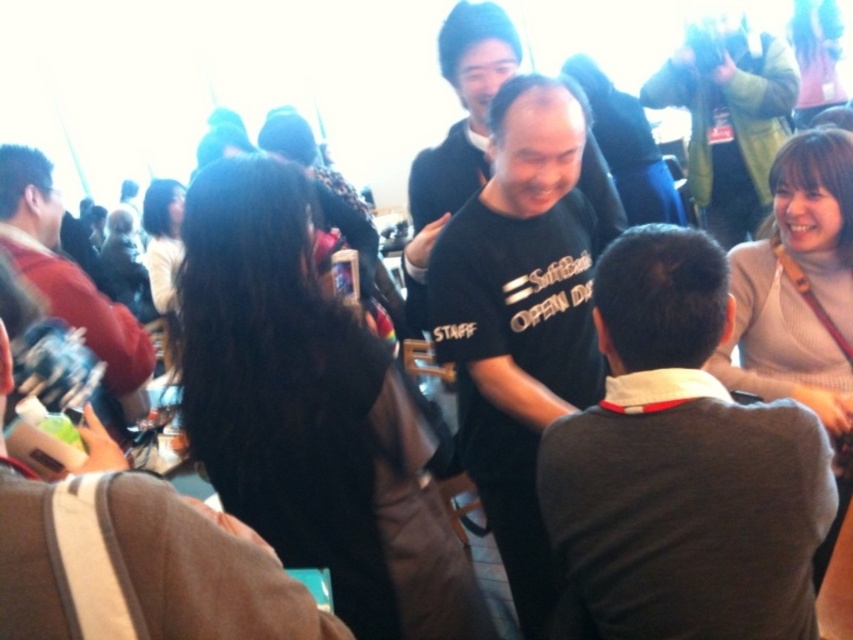
Question: Is matte black shirt at upper right above matte black shirt at left?

Choices:
 (A) yes
 (B) no

Answer: (A)

Question: Which of the following is the closest to the observer?

Choices:
 (A) (527, 118)
 (B) (740, 188)
 (C) (670, 289)
 (D) (35, 273)

Answer: (C)

Question: Based on their relative distances, which object is nearer to the black matte shirt at center?

Choices:
 (A) matte black shirt at left
 (B) matte black shirt at upper right

Answer: (A)

Question: Which is farther from the black matte shirt at center?

Choices:
 (A) matte black shirt at upper right
 (B) dark gray shirt at center
 (C) matte black shirt at left

Answer: (A)

Question: In this image, where is matte black shirt at upper right located relative to matte black shirt at left?

Choices:
 (A) above
 (B) below

Answer: (A)

Question: Can you confirm if dark gray shirt at center is bigger than matte black shirt at upper right?

Choices:
 (A) yes
 (B) no

Answer: (B)